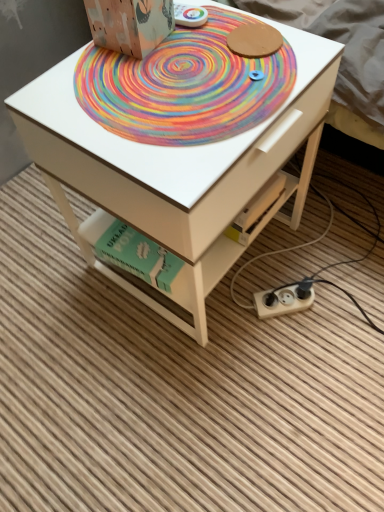
The width and height of the screenshot is (384, 512). I want to click on vacant space to the right of white plastic plug at lower right, so click(343, 293).